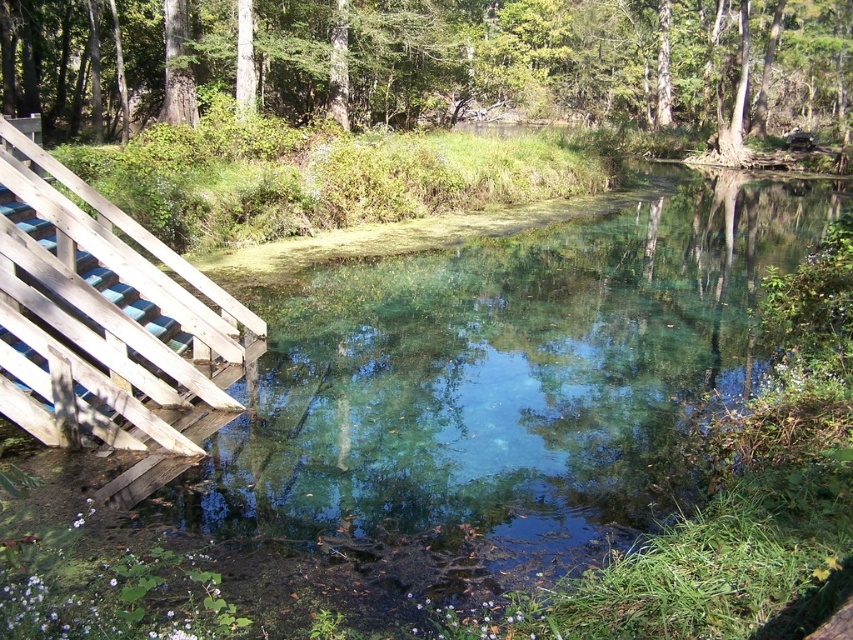
You are standing at the wooden planks at left and want to look towards the green leafy tree at upper center. Which object will appear wider from your perspective?

The green leafy tree at upper center appears wider than the wooden planks at left because its width surpasses the wooden planks at left.

You are standing on the wooden planks at left and want to look at the green leafy tree at upper center. Can you see the entire tree without any obstruction?

The wooden planks at left are behind the green leafy tree at upper center, so you can see the entire tree without obstruction because the tree is in front of the planks.

You are standing on the wooden planks at left and want to look at the green leafy tree at upper center. Which direction should you turn your head to see it?

The green leafy tree at upper center is larger in size compared to the wooden planks at left, so you should turn your head towards the upper center direction to see it.